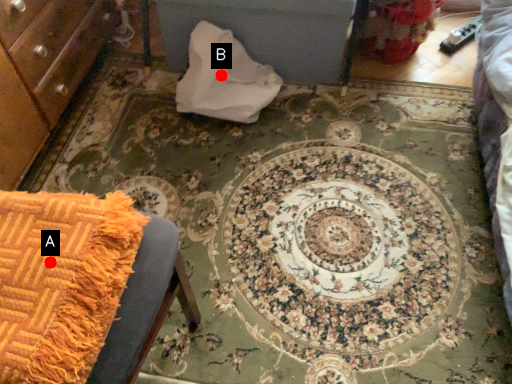
Question: Two points are circled on the image, labeled by A and B beside each circle. Which point appears farthest from the camera in this image?

Choices:
 (A) A is further
 (B) B is further

Answer: (B)